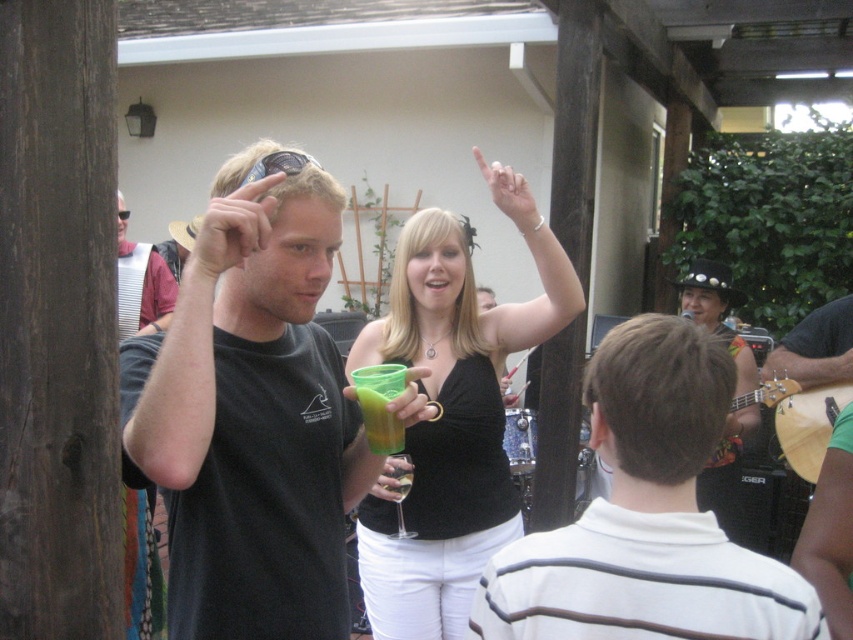
Question: Is the position of white striped shirt at center more distant than that of matte black tank top at center?

Choices:
 (A) yes
 (B) no

Answer: (B)

Question: Based on their relative distances, which object is nearer to the green translucent cup at center?

Choices:
 (A) black matte t-shirt at center
 (B) white striped shirt at center
 (C) matte black tank top at center
 (D) matte black shirt at left

Answer: (A)

Question: Which object appears closest to the camera in this image?

Choices:
 (A) matte black shirt at left
 (B) green translucent cup at center
 (C) black matte t-shirt at center
 (D) white striped shirt at center

Answer: (D)

Question: Which object appears farthest from the camera in this image?

Choices:
 (A) matte black shirt at left
 (B) black matte t-shirt at center
 (C) matte black tank top at center

Answer: (A)

Question: Can you confirm if matte black shirt at left is positioned to the left of green translucent cup at center?

Choices:
 (A) yes
 (B) no

Answer: (A)

Question: Can you confirm if matte black shirt at left is bigger than green translucent cup at center?

Choices:
 (A) no
 (B) yes

Answer: (B)